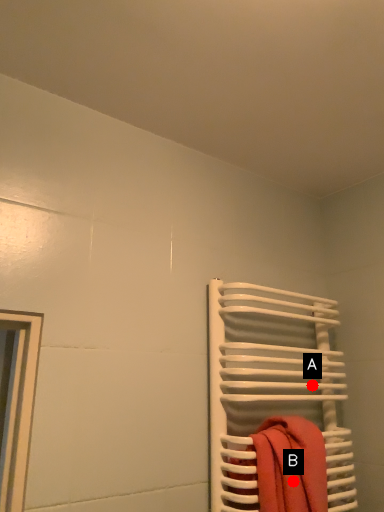
Question: Two points are circled on the image, labeled by A and B beside each circle. Which point is closer to the camera?

Choices:
 (A) A is closer
 (B) B is closer

Answer: (B)